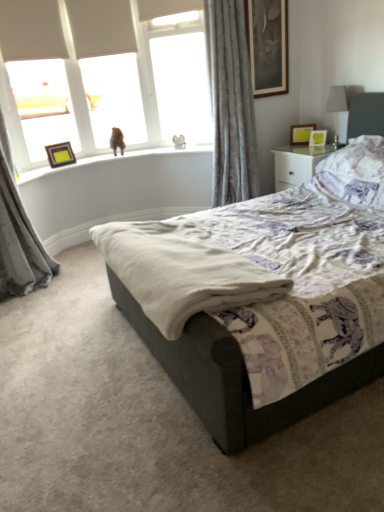
Locate an element on the screen. This screenshot has height=512, width=384. vacant area that is in front of matte yellow picture frame at upper right, the third picture frame in the bottom-to-top sequence is located at coordinates (308, 147).